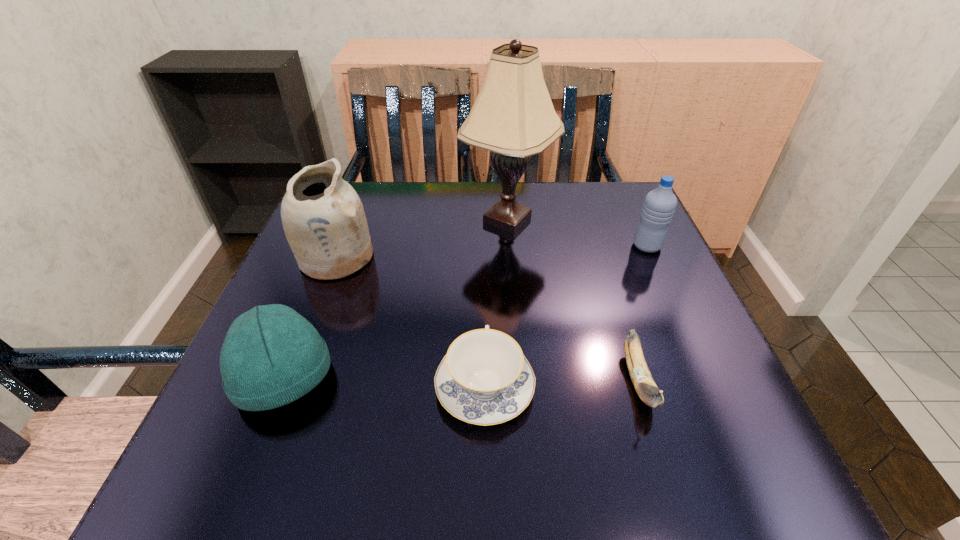
Image resolution: width=960 pixels, height=540 pixels. In order to click on vacant space located 0.250m on the back of the third shortest object in this screenshot , I will do `click(334, 252)`.

I want to click on vacant position located 0.100m at the stem of the second object from right to left, so click(x=673, y=491).

I want to click on free point located 0.360m with the handle on the side of the chinaware, so click(483, 228).

Identify the location of free space located 0.280m with the handle on the side of the chinaware. This screenshot has width=960, height=540. (484, 249).

Find the location of a particular element. This screenshot has height=540, width=960. free region located 0.170m with the handle on the side of the chinaware is located at coordinates (484, 282).

Locate an element on the screen. The height and width of the screenshot is (540, 960). lamp that is at the far edge is located at coordinates (513, 116).

Find the location of `pottery that is at the far edge`. pottery that is at the far edge is located at coordinates (323, 218).

The width and height of the screenshot is (960, 540). What are the coordinates of `object situated at the near edge` in the screenshot? It's located at (484, 379).

The image size is (960, 540). Find the location of `pottery at the left edge`. pottery at the left edge is located at coordinates (323, 218).

At what (x,y) coordinates should I click in order to perform the action: click on beanie present at the left edge. Please return your answer as a coordinate pair (x, y). The image size is (960, 540). Looking at the image, I should click on (271, 356).